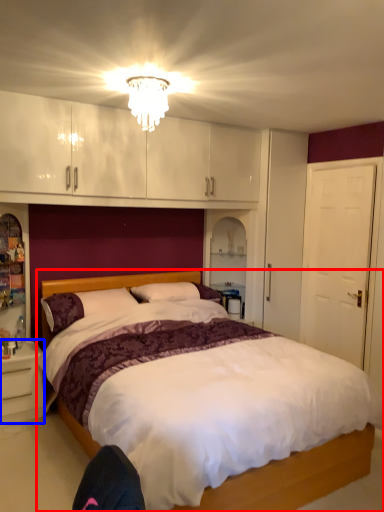
Question: Among these objects, which one is nearest to the camera, bed (highlighted by a red box) or nightstand (highlighted by a blue box)?

Choices:
 (A) bed
 (B) nightstand

Answer: (A)